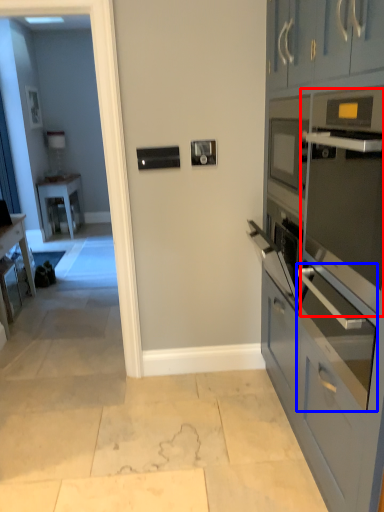
Question: Which of the following is the farthest to the observer, oven (highlighted by a red box) or oven (highlighted by a blue box)?

Choices:
 (A) oven
 (B) oven

Answer: (B)